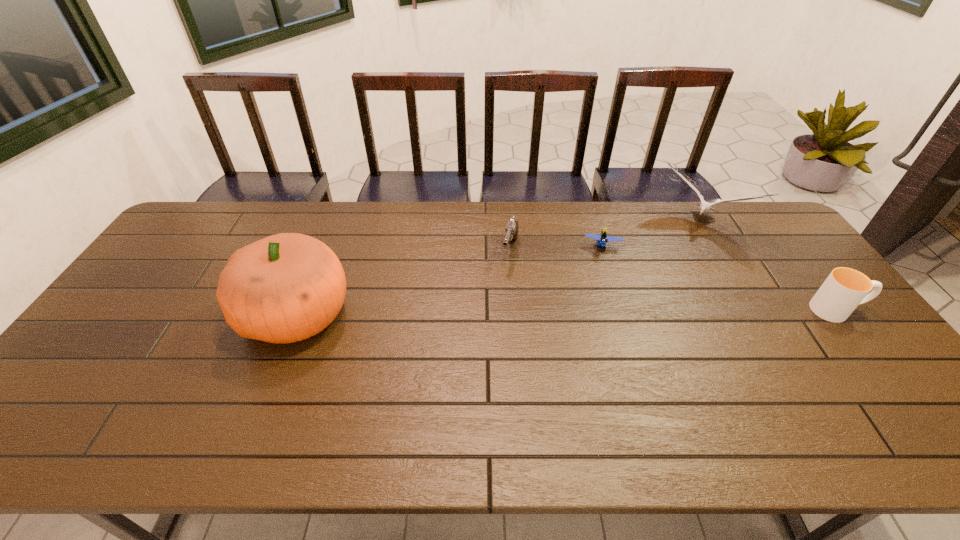
Identify the location of blank space located 0.100m on the face of the tallest object. This screenshot has width=960, height=540. (208, 314).

What are the coordinates of `free space located on the front-facing side of the third object from left to right` in the screenshot? It's located at (600, 302).

This screenshot has height=540, width=960. What are the coordinates of `vacant space located 0.200m on the front-facing side of the third object from left to right` in the screenshot? It's located at (600, 300).

At what (x,y) coordinates should I click in order to perform the action: click on vacant space located 0.060m on the front-facing side of the third object from left to right. Please return your answer as a coordinate pair (x, y). The height and width of the screenshot is (540, 960). Looking at the image, I should click on (601, 268).

The height and width of the screenshot is (540, 960). I want to click on vacant space located at the barrel of the pistol, so click(491, 332).

The width and height of the screenshot is (960, 540). Find the location of `vacant space located 0.360m at the barrel of the pistol`. vacant space located 0.360m at the barrel of the pistol is located at coordinates (481, 362).

The width and height of the screenshot is (960, 540). What are the coordinates of `free space located at the barrel of the pistol` in the screenshot? It's located at (492, 324).

The height and width of the screenshot is (540, 960). I want to click on blank area located at the tip of the beak of the fourth object from left to right, so click(x=636, y=309).

Identify the location of vacant region located 0.070m at the tip of the beak of the fourth object from left to right. The height and width of the screenshot is (540, 960). (675, 250).

Locate an element on the screen. This screenshot has height=540, width=960. free location located 0.360m at the tip of the beak of the fourth object from left to right is located at coordinates (640, 303).